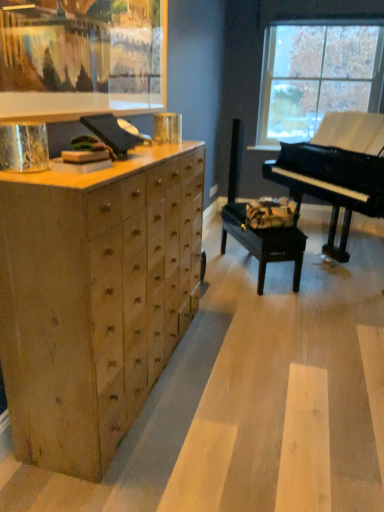
Identify the location of wooden picture frame at upper left. (82, 58).

This screenshot has width=384, height=512. Describe the element at coordinates (336, 170) in the screenshot. I see `black polished piano at right` at that location.

The height and width of the screenshot is (512, 384). What do you see at coordinates (95, 298) in the screenshot?
I see `natural wood chest of drawers at left` at bounding box center [95, 298].

Find the location of a particular element. wooden picture frame at upper left is located at coordinates click(x=82, y=58).

Is the position of black polished piano at right less distant than that of wooden picture frame at upper left?

No, it is not.

Which of these two, black polished piano at right or wooden picture frame at upper left, stands shorter?

wooden picture frame at upper left.

Is wooden picture frame at upper left at the back of black polished piano at right?

No.

From the image's perspective, which one is positioned higher, black polished piano at right or wooden picture frame at upper left?

wooden picture frame at upper left appears higher in the image.

From a real-world perspective, between black wood music stool at center and black polished piano at right, who is vertically higher?

black polished piano at right is physically above.

Considering the points (266, 230) and (303, 174), which point is in front, point (266, 230) or point (303, 174)?

Point (266, 230)

Is black wood music stool at center facing away from black polished piano at right?

black wood music stool at center is not turned away from black polished piano at right.

Can you confirm if black wood music stool at center is shorter than black polished piano at right?

Yes, black wood music stool at center is shorter than black polished piano at right.

Locate an element on the screen. The image size is (384, 512). window to the left of black polished piano at right is located at coordinates (317, 75).

Would you consider transparent glass window at upper right to be distant from black polished piano at right?

transparent glass window at upper right is far away from black polished piano at right.

Which is in front, point (266, 113) or point (358, 157)?

The point (358, 157) is closer to the camera.

From a real-world perspective, which is physically below, transparent glass window at upper right or black polished piano at right?

black polished piano at right, from a real-world perspective.

Is the depth of black wood music stool at center less than that of wooden picture frame at upper left?

No, black wood music stool at center is further to the viewer.

Could you tell me if black wood music stool at center is turned towards wooden picture frame at upper left?

No, black wood music stool at center is not facing towards wooden picture frame at upper left.

Would you say black wood music stool at center contains wooden picture frame at upper left?

Definitely not — wooden picture frame at upper left is not inside black wood music stool at center.

Looking at this image, from the image's perspective, is black wood music stool at center under wooden picture frame at upper left?

Yes.

Which is more to the left, wooden picture frame at upper left or natural wood chest of drawers at left?

wooden picture frame at upper left is more to the left.

What are the coordinates of `the chest of drawers below the wooden picture frame at upper left (from the image's perspective)` in the screenshot? It's located at tap(95, 298).

Is wooden picture frame at upper left facing towards natural wood chest of drawers at left?

No, wooden picture frame at upper left does not turn towards natural wood chest of drawers at left.

From the image's perspective, between wooden picture frame at upper left and natural wood chest of drawers at left, which one is located above?

wooden picture frame at upper left.

Is black polished piano at right behind transparent glass window at upper right?

No, black polished piano at right is closer to the camera.

Is point (348, 116) positioned after point (271, 106)?

No.

From the image's perspective, is black polished piano at right positioned above or below transparent glass window at upper right?

From the image's perspective, black polished piano at right appears below transparent glass window at upper right.

Image resolution: width=384 pixels, height=512 pixels. In order to click on piano that is below the transparent glass window at upper right (from the image's perspective) in this screenshot , I will do (x=336, y=170).

From a real-world perspective, is black polished piano at right above or below black wood music stool at center?

Clearly, from a real-world perspective, black polished piano at right is above black wood music stool at center.

Which object is further away from the camera, black polished piano at right or black wood music stool at center?

black wood music stool at center.

Is black polished piano at right aimed at black wood music stool at center?

Yes, black polished piano at right is aimed at black wood music stool at center.

In the scene shown: How much distance is there between black polished piano at right and black wood music stool at center?

27.29 inches.

Identify the location of piano below the wooden picture frame at upper left (from a real-world perspective). The image size is (384, 512). (336, 170).

Find the location of a particular element. This screenshot has height=512, width=384. piano above the black wood music stool at center (from the image's perspective) is located at coordinates 336,170.

Based on their spatial positions, is transparent glass window at upper right or black wood music stool at center further from wooden picture frame at upper left?

transparent glass window at upper right lies further to wooden picture frame at upper left than the other object.

Considering their positions, is black wood music stool at center positioned further to black polished piano at right than wooden picture frame at upper left?

The object further to black polished piano at right is wooden picture frame at upper left.

When comparing their distances from wooden picture frame at upper left, does black wood music stool at center or natural wood chest of drawers at left seem further?

black wood music stool at center lies further to wooden picture frame at upper left than the other object.

When comparing their distances from wooden picture frame at upper left, does natural wood chest of drawers at left or black polished piano at right seem further?

black polished piano at right is further to wooden picture frame at upper left.

When comparing their distances from black polished piano at right, does wooden picture frame at upper left or black wood music stool at center seem closer?

black wood music stool at center.

Based on their spatial positions, is transparent glass window at upper right or natural wood chest of drawers at left closer to black polished piano at right?

The object closer to black polished piano at right is transparent glass window at upper right.

Considering their positions, is natural wood chest of drawers at left positioned closer to black polished piano at right than transparent glass window at upper right?

Among the two, transparent glass window at upper right is located nearer to black polished piano at right.

Estimate the real-world distances between objects in this image. Which object is further from transparent glass window at upper right, black wood music stool at center or black polished piano at right?

Based on the image, black wood music stool at center appears to be further to transparent glass window at upper right.

The width and height of the screenshot is (384, 512). What are the coordinates of `music stool between natural wood chest of drawers at left and transparent glass window at upper right in the front-back direction` in the screenshot? It's located at (264, 242).

You are a GUI agent. You are given a task and a screenshot of the screen. Output one action in this format:
    pyautogui.click(x=<x>, y=<y>)
    Task: Click on the chest of drawers located between wooden picture frame at upper left and black polished piano at right in the left-right direction
    
    Given the screenshot: What is the action you would take?
    pyautogui.click(x=95, y=298)

The height and width of the screenshot is (512, 384). What are the coordinates of `piano located between wooden picture frame at upper left and transparent glass window at upper right in the depth direction` in the screenshot? It's located at (336, 170).

This screenshot has height=512, width=384. Find the location of `music stool positioned between black polished piano at right and transparent glass window at upper right from near to far`. music stool positioned between black polished piano at right and transparent glass window at upper right from near to far is located at coordinates (264, 242).